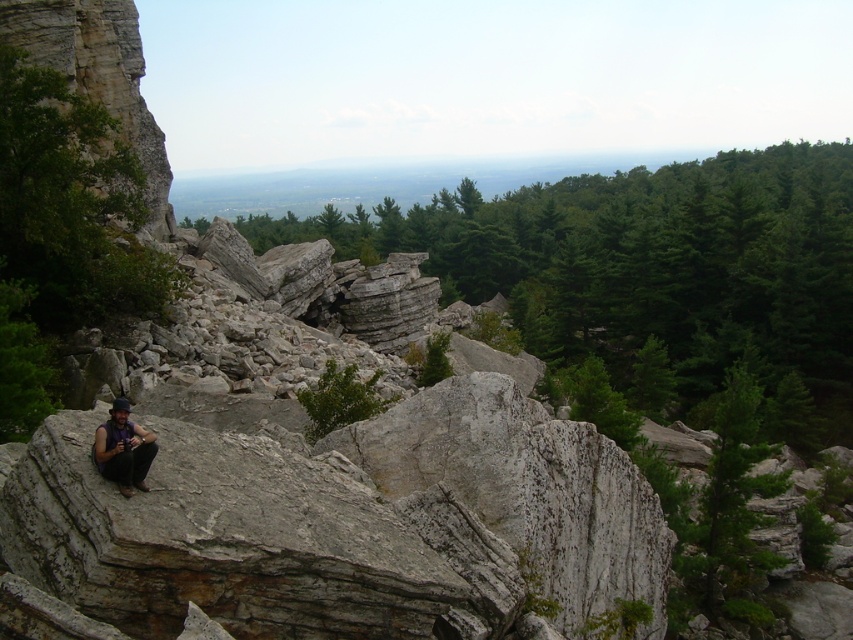
Between green leafy shrub at center and matte black shirt at lower left, which one has less height?

matte black shirt at lower left is shorter.

In the scene shown: Is green leafy shrub at center smaller than matte black shirt at lower left?

Actually, green leafy shrub at center might be larger than matte black shirt at lower left.

At what (x,y) coordinates should I click in order to perform the action: click on green leafy shrub at center. Please return your answer as a coordinate pair (x, y). The width and height of the screenshot is (853, 640). Looking at the image, I should click on (339, 400).

Find the location of a particular element. green leafy shrub at center is located at coordinates (339, 400).

Is green matte tree at right thinner than green leafy shrub at center?

Incorrect, green matte tree at right's width is not less than green leafy shrub at center's.

Between point (738, 380) and point (344, 381), which one is positioned in front?

Positioned in front is point (344, 381).

Is point (724, 518) in front of point (351, 406)?

No, (724, 518) is behind (351, 406).

Where is `green matte tree at right`? The height and width of the screenshot is (640, 853). green matte tree at right is located at coordinates (732, 504).

Which is above, green leafy tree at center or matte black shirt at lower left?

green leafy tree at center

Is green leafy tree at center to the right of matte black shirt at lower left from the viewer's perspective?

Correct, you'll find green leafy tree at center to the right of matte black shirt at lower left.

Is point (769, 150) positioned behind point (123, 422)?

That is True.

Where is `green leafy tree at center`? green leafy tree at center is located at coordinates (651, 273).